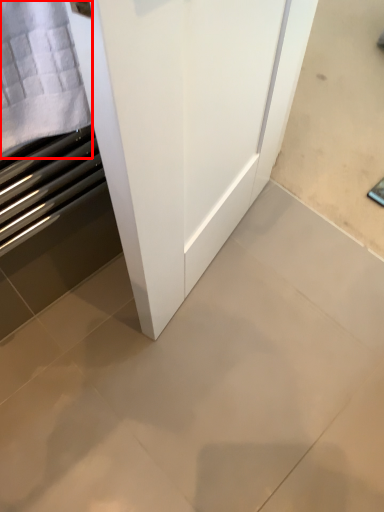
Question: From the image's perspective, what is the correct spatial relationship of cloth (annotated by the red box) in relation to ceramic tile?

Choices:
 (A) below
 (B) above

Answer: (B)